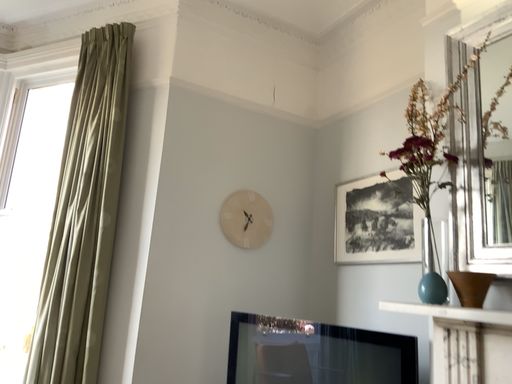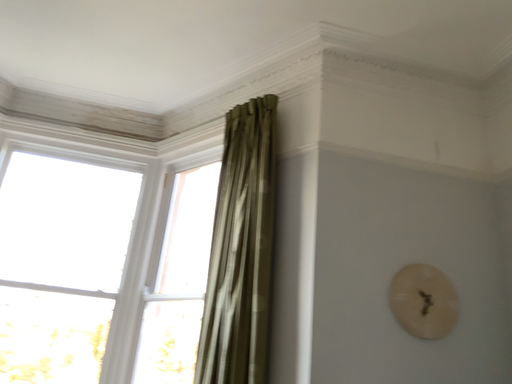
Question: How did the camera likely rotate when shooting the video?

Choices:
 (A) rotated upward
 (B) rotated downward

Answer: (A)